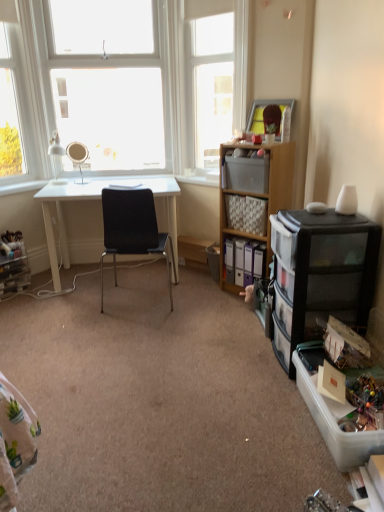
Question: From the image's perspective, would you say clear plastic storage box at lower right, acting as the first storage box starting from the front, is positioned over white plastic window sill at center?

Choices:
 (A) yes
 (B) no

Answer: (B)

Question: Is clear plastic storage box at lower right, acting as the first storage box starting from the front, outside white plastic window sill at center?

Choices:
 (A) yes
 (B) no

Answer: (A)

Question: Is clear plastic storage box at lower right, acting as the first storage box starting from the front, not close to white plastic window sill at center?

Choices:
 (A) yes
 (B) no

Answer: (A)

Question: Is clear plastic storage box at lower right, the first storage box ordered from the bottom, thinner than white plastic window sill at center?

Choices:
 (A) yes
 (B) no

Answer: (B)

Question: Is clear plastic storage box at lower right, marked as the 2th storage box in a back-to-front arrangement, bigger than white plastic window sill at center?

Choices:
 (A) yes
 (B) no

Answer: (A)

Question: In the image, is matte plastic storage box at center-right, which is the second storage box in front-to-back order, positioned in front of or behind clear plastic storage box at lower right, marked as the 2th storage box in a top-to-bottom arrangement?

Choices:
 (A) front
 (B) behind

Answer: (B)

Question: From their relative heights in the image, would you say matte plastic storage box at center-right, placed as the second storage box when sorted from bottom to top, is taller or shorter than clear plastic storage box at lower right, the first storage box ordered from the bottom?

Choices:
 (A) short
 (B) tall

Answer: (B)

Question: Is point (248, 161) closer or farther from the camera than point (334, 446)?

Choices:
 (A) closer
 (B) farther

Answer: (B)

Question: From the image's perspective, relative to clear plastic storage box at lower right, the first storage box ordered from the bottom, is matte plastic storage box at center-right, the first storage box positioned from the top, above or below?

Choices:
 (A) below
 (B) above

Answer: (B)

Question: Relative to transparent glass window at upper center, which is the 1th window from right to left, is white glass window at upper left, arranged as the first window when viewed from the left, in front or behind?

Choices:
 (A) front
 (B) behind

Answer: (B)

Question: Is white glass window at upper left, which is the 3th window in right-to-left order, bigger or smaller than transparent glass window at upper center, acting as the third window starting from the left?

Choices:
 (A) big
 (B) small

Answer: (B)

Question: In terms of width, does white glass window at upper left, which is the 3th window in right-to-left order, look wider or thinner when compared to transparent glass window at upper center, which is the 1th window from right to left?

Choices:
 (A) thin
 (B) wide

Answer: (A)

Question: Is white glass window at upper left, arranged as the first window when viewed from the left, inside or outside of transparent glass window at upper center, acting as the third window starting from the left?

Choices:
 (A) inside
 (B) outside

Answer: (B)

Question: Is white glass window at upper left, which is the 3th window in right-to-left order, inside or outside of matte silver mirror at upper left?

Choices:
 (A) outside
 (B) inside

Answer: (A)

Question: Considering the positions of white glass window at upper left, arranged as the first window when viewed from the left, and matte silver mirror at upper left in the image, is white glass window at upper left, arranged as the first window when viewed from the left, taller or shorter than matte silver mirror at upper left?

Choices:
 (A) short
 (B) tall

Answer: (B)